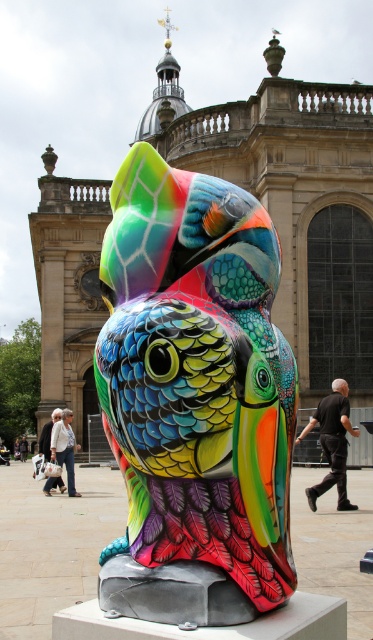
You are a photographer standing in front of the toucan sculpture. You notice a black cotton shirt at center and a white cotton jacket at lower left. Which clothing item is positioned to the right of the other?

The black cotton shirt at center is to the right of the white cotton jacket at lower left.